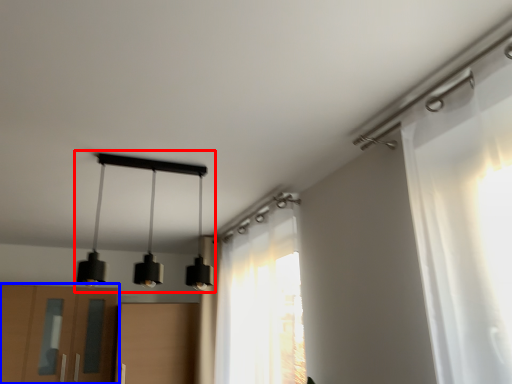
Question: Which object is closer to the camera taking this photo, lamp (highlighted by a red box) or cabinetry (highlighted by a blue box)?

Choices:
 (A) lamp
 (B) cabinetry

Answer: (A)